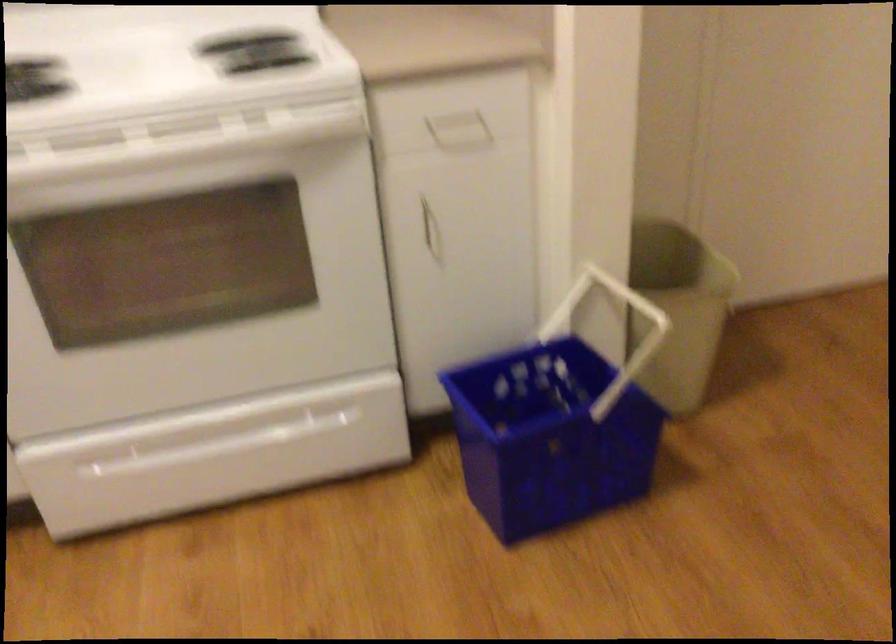
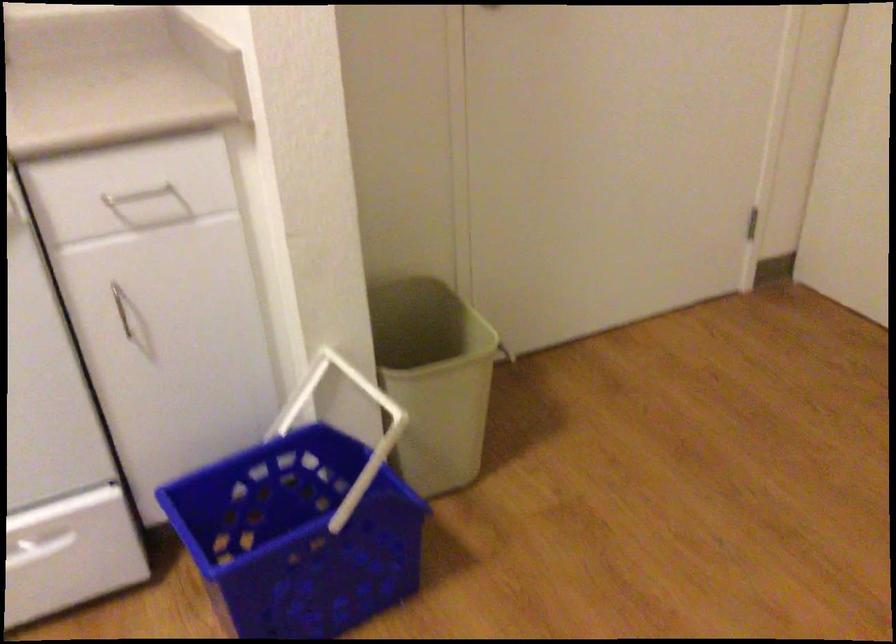
Question: The camera is either moving clockwise (left) or counter-clockwise (right) around the object. The first image is from the beginning of the video and the second image is from the end. Is the camera moving left or right when shooting the video?

Choices:
 (A) Left
 (B) Right

Answer: (A)